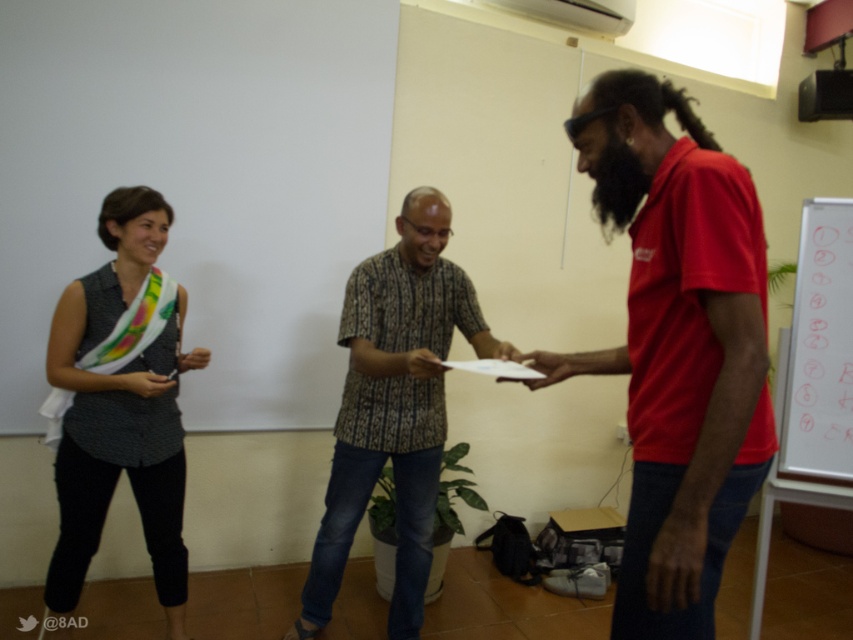
You are standing in the room and want to place a small decorative item between the matte black shirt at left and the white paperboard at right. Considering their sizes, which object should the item be closer to?

The matte black shirt at left is larger in size than the white paperboard at right, so the small decorative item should be placed closer to the white paperboard at right to balance the sizes.